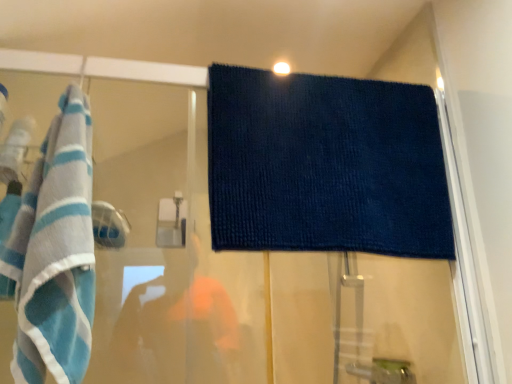
At what (x,y) coordinates should I click in order to perform the action: click on dark blue textured towel at upper center, which is the 1th towel from right to left. Please return your answer as a coordinate pair (x, y). The width and height of the screenshot is (512, 384). Looking at the image, I should click on (325, 165).

What do you see at coordinates (325, 165) in the screenshot? The width and height of the screenshot is (512, 384). I see `dark blue textured towel at upper center, the first towel positioned from the back` at bounding box center [325, 165].

Image resolution: width=512 pixels, height=384 pixels. Describe the element at coordinates (54, 253) in the screenshot. I see `blue striped towel at left, which ranks as the 2th towel in back-to-front order` at that location.

Image resolution: width=512 pixels, height=384 pixels. Identify the location of blue striped towel at left, which ranks as the 2th towel in back-to-front order. (54, 253).

Identify the location of dark blue textured towel at upper center, which is the 1th towel from right to left. The image size is (512, 384). (325, 165).

Which object is positioned more to the right, blue striped towel at left, the first towel positioned from the left, or dark blue textured towel at upper center, which is the 1th towel from right to left?

dark blue textured towel at upper center, which is the 1th towel from right to left, is more to the right.

Which object is closer to the camera taking this photo, blue striped towel at left, the first towel positioned from the left, or dark blue textured towel at upper center, which is the 1th towel from right to left?

blue striped towel at left, the first towel positioned from the left, is in front.

Between point (48, 180) and point (215, 161), which one is positioned behind?

The point (215, 161) is behind.

From the image's perspective, is blue striped towel at left, which is the 2th towel from right to left, located beneath dark blue textured towel at upper center, which ranks as the second towel in front-to-back order?

Indeed, from the image's perspective, blue striped towel at left, which is the 2th towel from right to left, is shown beneath dark blue textured towel at upper center, which ranks as the second towel in front-to-back order.

From a real-world perspective, which object rests below the other?

blue striped towel at left, which ranks as the 2th towel in back-to-front order, is physically lower.

Considering the sizes of blue striped towel at left, which ranks as the 2th towel in back-to-front order, and dark blue textured towel at upper center, which ranks as the second towel in front-to-back order, in the image, is blue striped towel at left, which ranks as the 2th towel in back-to-front order, wider or thinner than dark blue textured towel at upper center, which ranks as the second towel in front-to-back order,?

Considering their sizes, blue striped towel at left, which ranks as the 2th towel in back-to-front order, looks broader than dark blue textured towel at upper center, which ranks as the second towel in front-to-back order.

Considering the relative sizes of blue striped towel at left, arranged as the 1th towel when viewed from the front, and dark blue textured towel at upper center, which ranks as the second towel in front-to-back order, in the image provided, is blue striped towel at left, arranged as the 1th towel when viewed from the front, shorter than dark blue textured towel at upper center, which ranks as the second towel in front-to-back order,?

In fact, blue striped towel at left, arranged as the 1th towel when viewed from the front, may be taller than dark blue textured towel at upper center, which ranks as the second towel in front-to-back order.

In terms of size, does blue striped towel at left, arranged as the 1th towel when viewed from the front, appear bigger or smaller than dark blue textured towel at upper center, which appears as the 2th towel when viewed from the left?

Considering their sizes, blue striped towel at left, arranged as the 1th towel when viewed from the front, takes up more space than dark blue textured towel at upper center, which appears as the 2th towel when viewed from the left.

Is dark blue textured towel at upper center, which appears as the 2th towel when viewed from the left, a part of blue striped towel at left, the first towel positioned from the left?

Definitely not — dark blue textured towel at upper center, which appears as the 2th towel when viewed from the left, is not inside blue striped towel at left, the first towel positioned from the left.

Is blue striped towel at left, the first towel positioned from the left, next to dark blue textured towel at upper center, which appears as the 2th towel when viewed from the left, and touching it?

No, blue striped towel at left, the first towel positioned from the left, is not touching dark blue textured towel at upper center, which appears as the 2th towel when viewed from the left.

Is blue striped towel at left, the first towel positioned from the left, oriented towards dark blue textured towel at upper center, which appears as the 2th towel when viewed from the left?

No, blue striped towel at left, the first towel positioned from the left, does not turn towards dark blue textured towel at upper center, which appears as the 2th towel when viewed from the left.

In the scene shown: How far apart are blue striped towel at left, arranged as the 1th towel when viewed from the front, and dark blue textured towel at upper center, the first towel positioned from the back?

They are 17.40 inches apart.

Where is `towel lying below the dark blue textured towel at upper center, which is the 1th towel from right to left (from the image's perspective)`? This screenshot has height=384, width=512. towel lying below the dark blue textured towel at upper center, which is the 1th towel from right to left (from the image's perspective) is located at coordinates (54, 253).

Considering the positions of objects dark blue textured towel at upper center, which ranks as the second towel in front-to-back order, and blue striped towel at left, the first towel positioned from the left, in the image provided, who is more to the right, dark blue textured towel at upper center, which ranks as the second towel in front-to-back order, or blue striped towel at left, the first towel positioned from the left,?

dark blue textured towel at upper center, which ranks as the second towel in front-to-back order, is more to the right.

Is dark blue textured towel at upper center, the first towel positioned from the back, closer to the viewer compared to blue striped towel at left, the first towel positioned from the left?

No, it is behind blue striped towel at left, the first towel positioned from the left.

Is point (377, 250) in front of point (67, 266)?

No, (377, 250) is behind (67, 266).

From the image's perspective, does dark blue textured towel at upper center, which is the 1th towel from right to left, appear lower than blue striped towel at left, which is the 2th towel from right to left?

No, from the image's perspective, dark blue textured towel at upper center, which is the 1th towel from right to left, is not below blue striped towel at left, which is the 2th towel from right to left.

From a real-world perspective, is dark blue textured towel at upper center, which appears as the 2th towel when viewed from the left, beneath blue striped towel at left, arranged as the 1th towel when viewed from the front?

No, from a real-world perspective, dark blue textured towel at upper center, which appears as the 2th towel when viewed from the left, is not beneath blue striped towel at left, arranged as the 1th towel when viewed from the front.

Considering the relative sizes of dark blue textured towel at upper center, which is the 1th towel from right to left, and blue striped towel at left, which ranks as the 2th towel in back-to-front order, in the image provided, is dark blue textured towel at upper center, which is the 1th towel from right to left, wider than blue striped towel at left, which ranks as the 2th towel in back-to-front order,?

No.

Which of these two, dark blue textured towel at upper center, the first towel positioned from the back, or blue striped towel at left, the first towel positioned from the left, stands shorter?

dark blue textured towel at upper center, the first towel positioned from the back, is shorter.

Considering the relative sizes of dark blue textured towel at upper center, which ranks as the second towel in front-to-back order, and blue striped towel at left, arranged as the 1th towel when viewed from the front, in the image provided, is dark blue textured towel at upper center, which ranks as the second towel in front-to-back order, smaller than blue striped towel at left, arranged as the 1th towel when viewed from the front,?

Indeed, dark blue textured towel at upper center, which ranks as the second towel in front-to-back order, has a smaller size compared to blue striped towel at left, arranged as the 1th towel when viewed from the front.

Is blue striped towel at left, which ranks as the 2th towel in back-to-front order, a part of dark blue textured towel at upper center, which appears as the 2th towel when viewed from the left?

No.

Is dark blue textured towel at upper center, which ranks as the second towel in front-to-back order, far away from blue striped towel at left, which ranks as the 2th towel in back-to-front order?

No, there isn't a large distance between dark blue textured towel at upper center, which ranks as the second towel in front-to-back order, and blue striped towel at left, which ranks as the 2th towel in back-to-front order.

Is dark blue textured towel at upper center, the first towel positioned from the back, oriented away from blue striped towel at left, which ranks as the 2th towel in back-to-front order?

dark blue textured towel at upper center, the first towel positioned from the back, is not turned away from blue striped towel at left, which ranks as the 2th towel in back-to-front order.

Find the location of `towel on the right of the blue striped towel at left, which is the 2th towel from right to left`. towel on the right of the blue striped towel at left, which is the 2th towel from right to left is located at coordinates (325, 165).

Where is `towel on the right of blue striped towel at left, the first towel positioned from the left`? towel on the right of blue striped towel at left, the first towel positioned from the left is located at coordinates (325, 165).

I want to click on towel located above the blue striped towel at left, which is the 2th towel from right to left (from a real-world perspective), so [x=325, y=165].